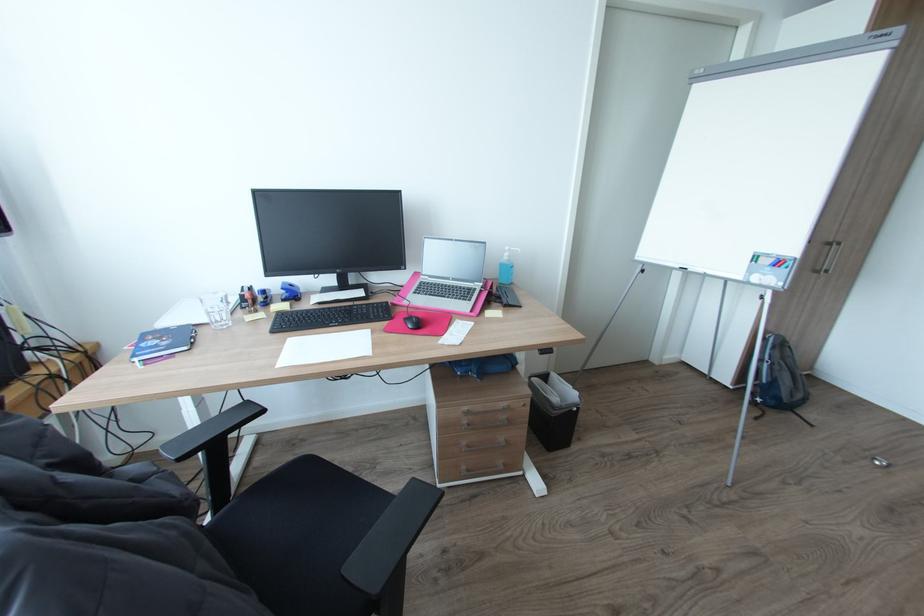
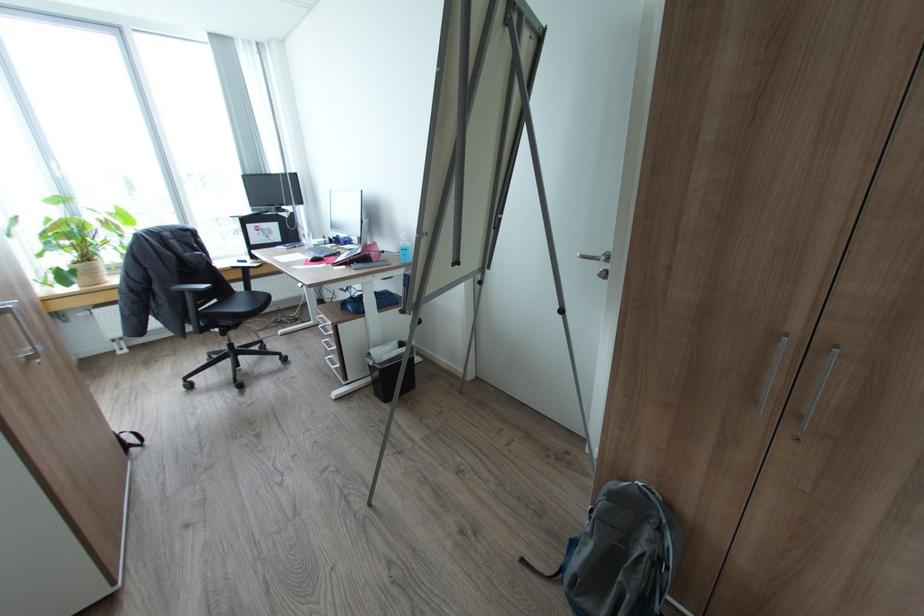
In the second image, find the point that corresponds to [761,418] in the first image.

(527, 560)